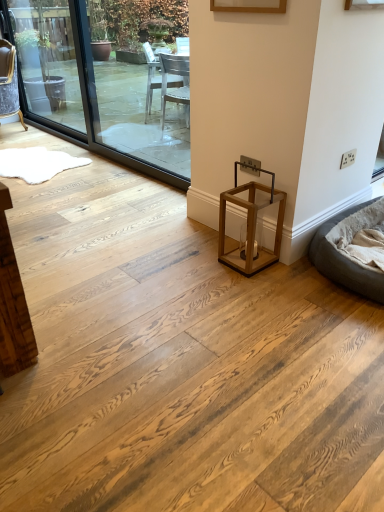
Question: Considering the relative positions of transparent glass window at upper left, arranged as the second window screen when viewed from the right, and velvet grey chair at left in the image provided, is transparent glass window at upper left, arranged as the second window screen when viewed from the right, to the right of velvet grey chair at left from the viewer's perspective?

Choices:
 (A) yes
 (B) no

Answer: (A)

Question: From the image's perspective, is transparent glass window at upper left, arranged as the second window screen when viewed from the right, under velvet grey chair at left?

Choices:
 (A) no
 (B) yes

Answer: (A)

Question: Does transparent glass window at upper left, the first window screen positioned from the left, have a larger size compared to velvet grey chair at left?

Choices:
 (A) no
 (B) yes

Answer: (A)

Question: Is transparent glass window at upper left, arranged as the second window screen when viewed from the right, smaller than velvet grey chair at left?

Choices:
 (A) no
 (B) yes

Answer: (B)

Question: From the image's perspective, is transparent glass window at upper left, the first window screen positioned from the left, on top of velvet grey chair at left?

Choices:
 (A) no
 (B) yes

Answer: (B)

Question: Is transparent glass window at upper left, the first window screen positioned from the left, not within velvet grey chair at left?

Choices:
 (A) yes
 (B) no

Answer: (A)

Question: Is transparent glass window at upper left, arranged as the second window screen when viewed from the right, shorter than transparent glass window at left, which appears as the 1th window screen when viewed from the right?

Choices:
 (A) no
 (B) yes

Answer: (A)

Question: Is the position of transparent glass window at upper left, arranged as the second window screen when viewed from the right, less distant than that of transparent glass window at left, which appears as the 1th window screen when viewed from the right?

Choices:
 (A) yes
 (B) no

Answer: (B)

Question: From the image's perspective, would you say transparent glass window at upper left, the first window screen positioned from the left, is shown under transparent glass window at left, which appears as the 1th window screen when viewed from the right?

Choices:
 (A) no
 (B) yes

Answer: (A)

Question: Is transparent glass window at upper left, the first window screen positioned from the left, surrounding transparent glass window at left, which ranks as the second window screen in left-to-right order?

Choices:
 (A) yes
 (B) no

Answer: (B)

Question: Is transparent glass window at upper left, arranged as the second window screen when viewed from the right, beside transparent glass window at left, which ranks as the second window screen in left-to-right order?

Choices:
 (A) yes
 (B) no

Answer: (B)

Question: Is transparent glass window at upper left, arranged as the second window screen when viewed from the right, wider than transparent glass window at left, which ranks as the second window screen in left-to-right order?

Choices:
 (A) yes
 (B) no

Answer: (B)

Question: Considering the relative sizes of velvet grey chair at left and transparent glass window at left, which appears as the 1th window screen when viewed from the right, in the image provided, is velvet grey chair at left thinner than transparent glass window at left, which appears as the 1th window screen when viewed from the right,?

Choices:
 (A) no
 (B) yes

Answer: (A)